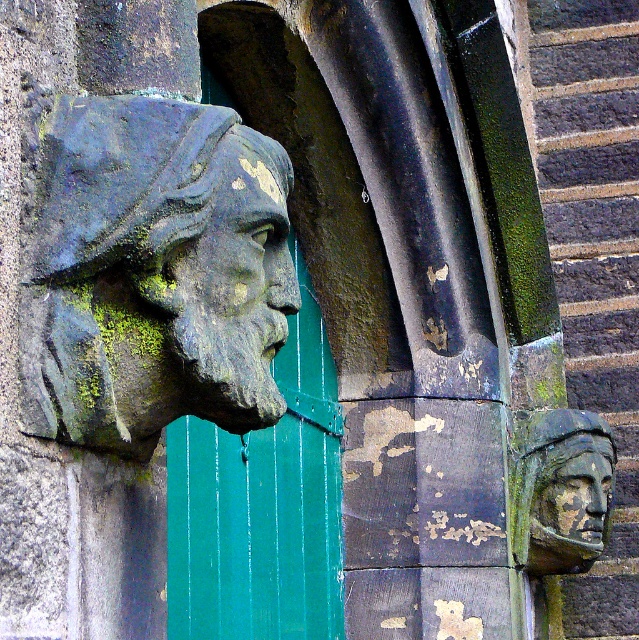
Is green mossy stone face at upper left wider than rusty stone head at right?

No.

Which is behind, point (220, 188) or point (518, 484)?

Positioned behind is point (518, 484).

What are the coordinates of `green mossy stone face at upper left` in the screenshot? It's located at (x=220, y=308).

Which of these two, green mossy stone face at upper left or rusty stone face at right, stands shorter?

rusty stone face at right

Which is more to the right, green mossy stone face at upper left or rusty stone face at right?

rusty stone face at right

The image size is (639, 640). Find the location of `green mossy stone face at upper left`. green mossy stone face at upper left is located at coordinates (220, 308).

Does green mossy stone head at left appear under green painted wood door at center?

Actually, green mossy stone head at left is above green painted wood door at center.

Is green mossy stone head at left smaller than green painted wood door at center?

Yes.

This screenshot has height=640, width=639. In order to click on green mossy stone head at left in this screenshot , I will do `click(155, 275)`.

Image resolution: width=639 pixels, height=640 pixels. Find the location of `green mossy stone head at left`. green mossy stone head at left is located at coordinates (155, 275).